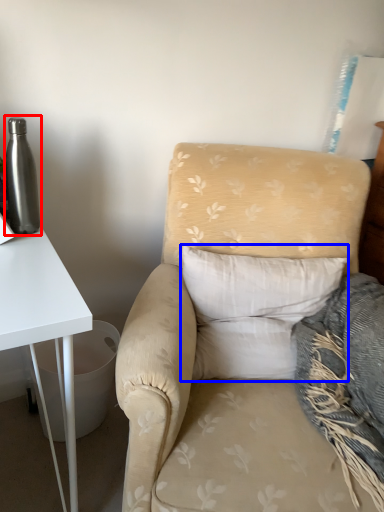
Question: Among these objects, which one is nearest to the camera, bottle (highlighted by a red box) or pillow (highlighted by a blue box)?

Choices:
 (A) bottle
 (B) pillow

Answer: (A)